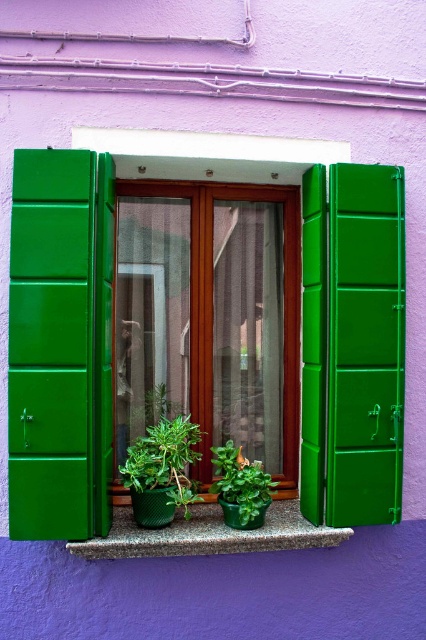
Is green plastic window box at center to the left of granite at center from the viewer's perspective?

Correct, you'll find green plastic window box at center to the left of granite at center.

Consider the image. Does green plastic window box at center appear over granite at center?

Indeed, green plastic window box at center is positioned over granite at center.

Does point (357, 520) come farther from viewer compared to point (261, 529)?

No, (357, 520) is closer to viewer.

I want to click on green plastic window box at center, so click(x=302, y=321).

Between green matte plant at center and green matte pot at center, which one has less height?

Standing shorter between the two is green matte pot at center.

Can you confirm if green matte plant at center is positioned to the left of green matte pot at center?

Yes, green matte plant at center is to the left of green matte pot at center.

Which is behind, point (146, 500) or point (244, 497)?

The point (244, 497) is behind.

Find the location of a particular element. The image size is (426, 640). green matte plant at center is located at coordinates (161, 472).

Is point (281, 525) less distant than point (152, 506)?

No, (281, 525) is behind (152, 506).

The width and height of the screenshot is (426, 640). What do you see at coordinates (207, 532) in the screenshot?
I see `granite at center` at bounding box center [207, 532].

Find the location of a particular element. This screenshot has height=640, width=426. granite at center is located at coordinates (207, 532).

This screenshot has height=640, width=426. I want to click on granite at center, so click(207, 532).